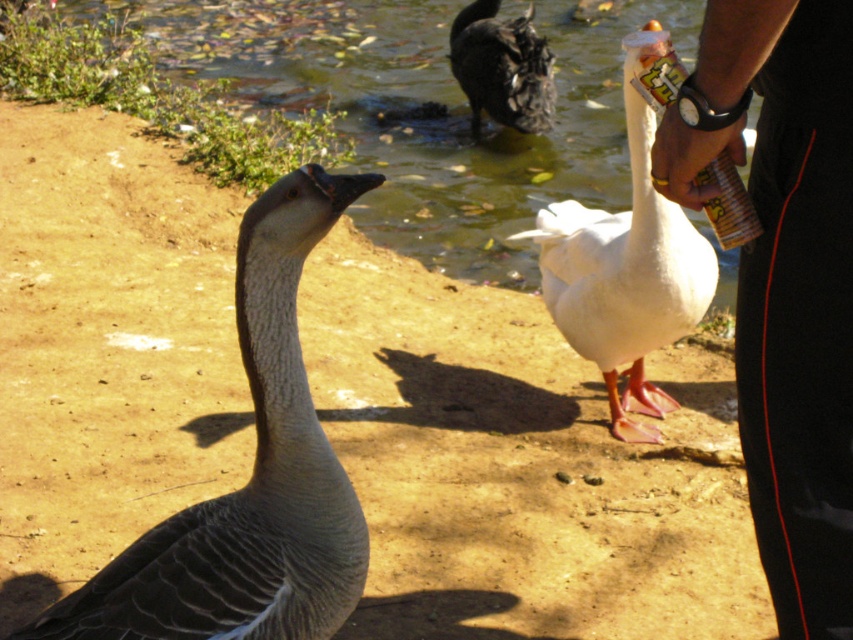
You are a wildlife photographer trying to capture both the gray feathered goose at center and the white matte goose at center in a single frame. Based on their sizes, which goose should you focus on to ensure both fit in the photo?

The gray feathered goose at center might be wider than the white matte goose at center, so focusing on the larger gray goose ensures both fit in the photo.

You are a birdwatcher observing the scene. You notice the gray feathered goose at center and the dark gray duck at upper center. Which one is positioned to the right side of the other?

The gray feathered goose at center is to the left of dark gray duck at upper center, so the dark gray duck at upper center is positioned to the right of the gray feathered goose at center.